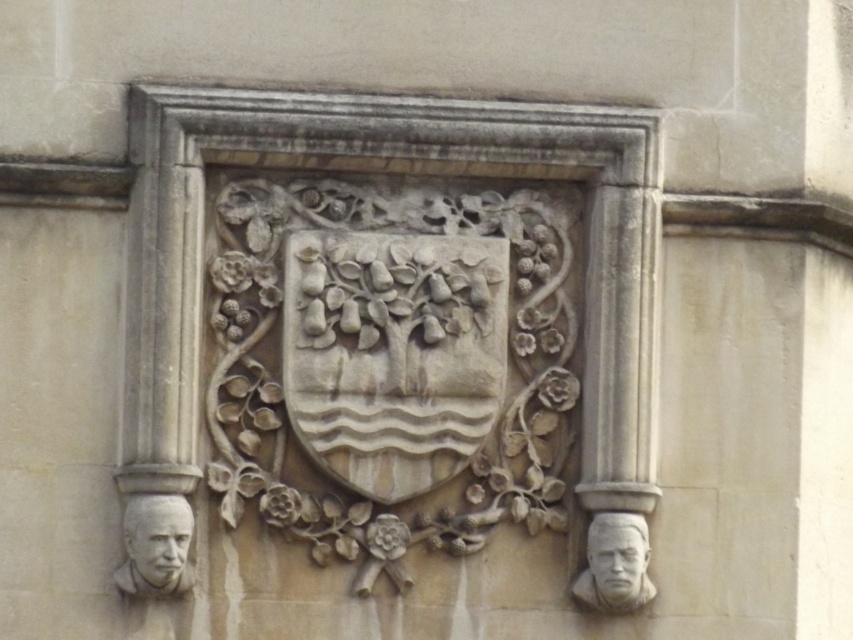
Question: Based on their relative distances, which object is nearer to the gray stone bust at lower right?

Choices:
 (A) gray stone bust at lower left
 (B) gray stone face at lower left

Answer: (A)

Question: Which object is closer to the camera taking this photo?

Choices:
 (A) gray stone bust at lower right
 (B) stone carved face at lower right

Answer: (A)

Question: Is gray stone bust at lower left smaller than stone carved face at lower right?

Choices:
 (A) yes
 (B) no

Answer: (B)

Question: Can you confirm if stone carved face at lower right is wider than gray stone face at lower left?

Choices:
 (A) yes
 (B) no

Answer: (B)

Question: Considering the real-world distances, which object is farthest from the stone carved face at lower right?

Choices:
 (A) gray stone face at lower left
 (B) gray stone bust at lower left

Answer: (B)

Question: Does gray stone bust at lower left appear on the right side of gray stone bust at lower right?

Choices:
 (A) no
 (B) yes

Answer: (A)